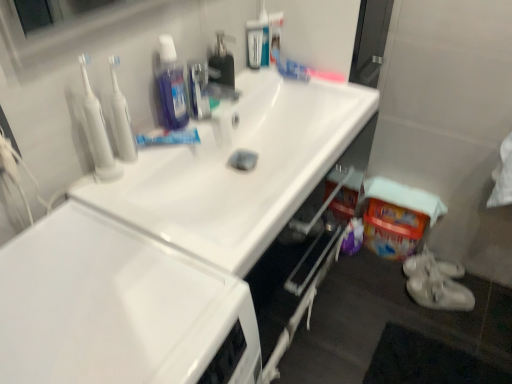
I want to click on free space above white glossy cabinet at lower center (from a real-world perspective), so click(x=115, y=304).